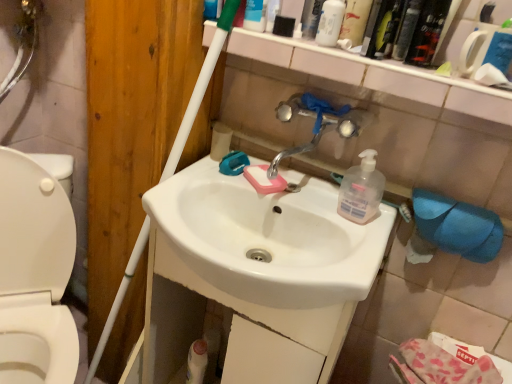
Question: Considering the positions of point (317, 36) and point (433, 49), is point (317, 36) closer or farther from the camera than point (433, 49)?

Choices:
 (A) closer
 (B) farther

Answer: (B)

Question: Is white matte bottle at upper center, which is counted as the 1th cleaning product, starting from the top, inside the boundaries of black plastic mouthwash at upper right, the third mouthwash from the left, or outside?

Choices:
 (A) inside
 (B) outside

Answer: (B)

Question: Considering the real-world distances, which object is closest to the white glossy toilet at left?

Choices:
 (A) black plastic mouthwash at upper right, the first mouthwash from the right
 (B) translucent plastic soap dispenser at center-right, which is counted as the first cleaning product, starting from the bottom
 (C) white glossy sink at center
 (D) white matte toilet paper at upper center, the first toilet paper viewed from the top
 (E) chrome metallic faucet at center

Answer: (C)

Question: Estimate the real-world distances between objects in this image. Which object is farther from the blue fabric toilet paper at lower right, positioned as the 1th toilet paper in right-to-left order?

Choices:
 (A) metallic silver canister at upper center, the 1th toiletry viewed from the right
 (B) white matte toilet paper at upper center, acting as the second toilet paper starting from the right
 (C) green plastic bottle at upper right, placed as the second mouthwash when sorted from right to left
 (D) white glossy toilet at left
 (E) translucent plastic mouthwash at upper right, the 1th mouthwash when ordered from left to right

Answer: (D)